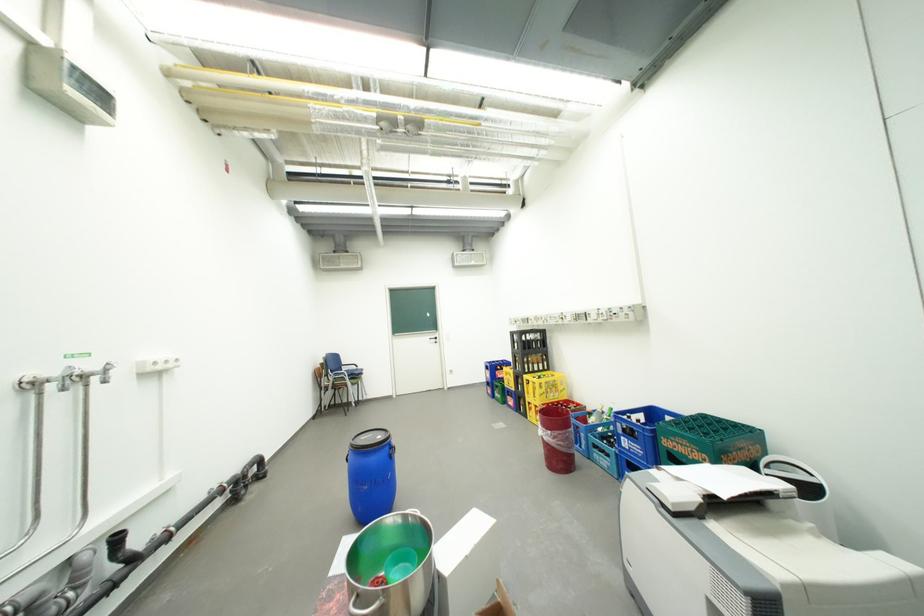
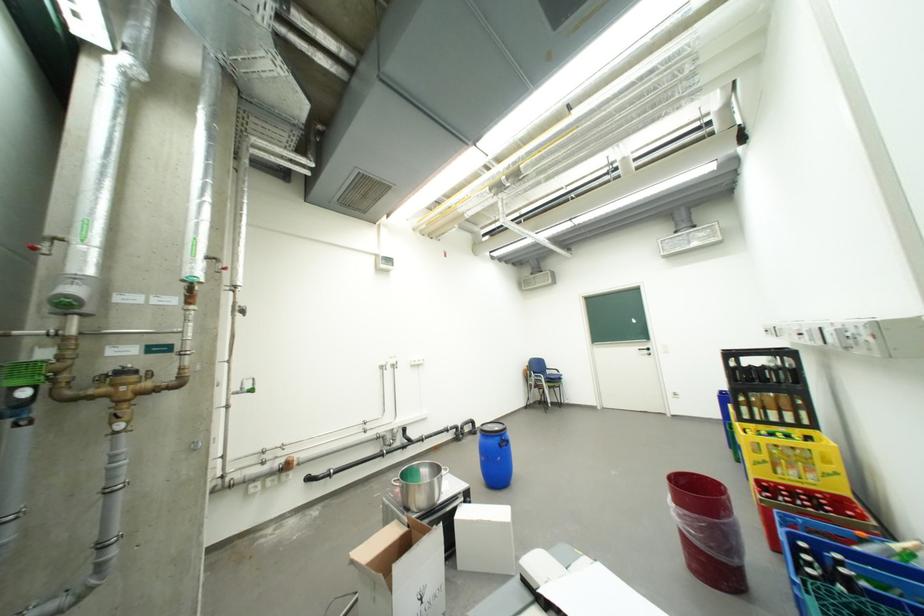
Where in the second image is the point corresponding to (478,553) from the first image?

(484, 520)